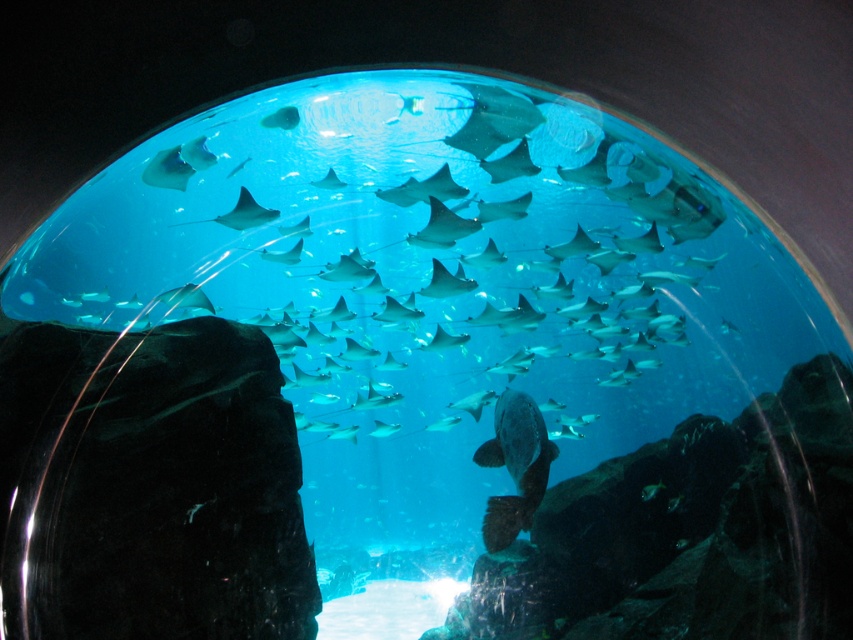
Question: Among these points, which one is nearest to the camera?

Choices:
 (A) (509, 522)
 (B) (650, 497)
 (C) (267, 124)

Answer: (A)

Question: Which of the following is the farthest from the observer?

Choices:
 (A) translucent greenish-blue fish at center
 (B) translucent blue fish at upper center
 (C) smooth gray stingray at upper center
 (D) dark gray matte fish at center

Answer: (A)

Question: Which of the following is the closest to the observer?

Choices:
 (A) (486, 148)
 (B) (646, 486)
 (C) (271, 125)

Answer: (C)

Question: Does translucent blue fish at upper center appear on the right side of translucent greenish-blue fish at center?

Choices:
 (A) yes
 (B) no

Answer: (B)

Question: Is smooth gray stingray at upper center further to the viewer compared to translucent greenish-blue fish at center?

Choices:
 (A) yes
 (B) no

Answer: (B)

Question: Is the position of dark gray matte fish at center more distant than that of smooth gray stingray at upper center?

Choices:
 (A) yes
 (B) no

Answer: (A)